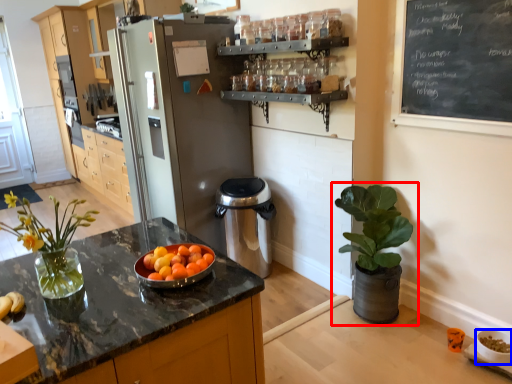
Question: Among these objects, which one is nearest to the camera, houseplant (highlighted by a red box) or glass bowl (highlighted by a blue box)?

Choices:
 (A) houseplant
 (B) glass bowl

Answer: (B)